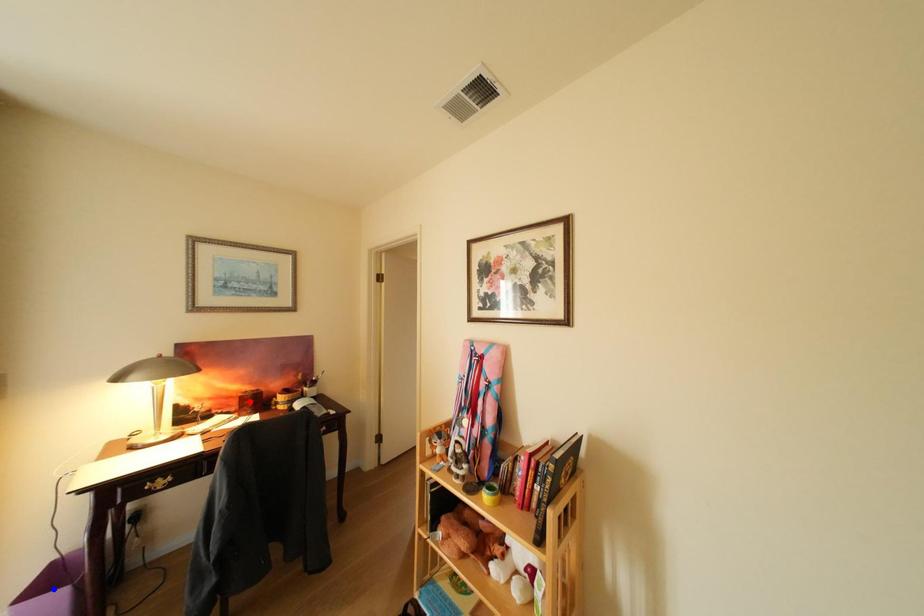
Question: Which of the two points in the image is closer to the camera?

Choices:
 (A) Blue point is closer.
 (B) Red point is closer.

Answer: (A)